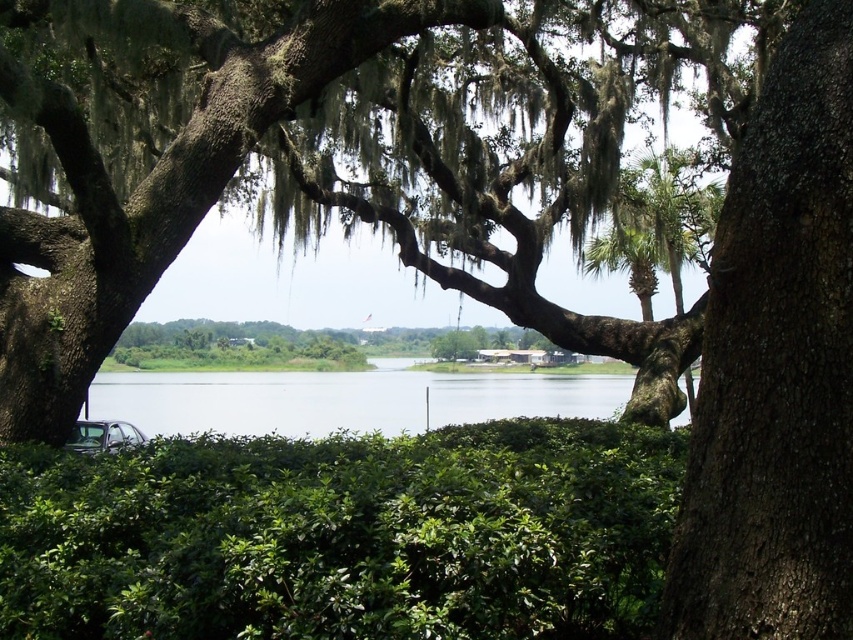
You are standing in the scene and want to walk from the green leafy hedge at lower center to the clear water at center. Which direction should you move?

You should move to the left to reach the clear water at center from the green leafy hedge at lower center since the hedge is to the right of the water.

You are standing in the scene and want to walk towards the green leafy hedge at lower center. Based on its position, which direction should you head?

The green leafy hedge at lower center is located at point (344, 536), so you should head towards the lower center direction to reach it.

You are standing at the edge of a pond and see the green leafy hedge at lower center and the clear water at center. Which object is closer to you?

The green leafy hedge at lower center is closer to you since it is positioned over the clear water at center, indicating it is in a lower or forward position.